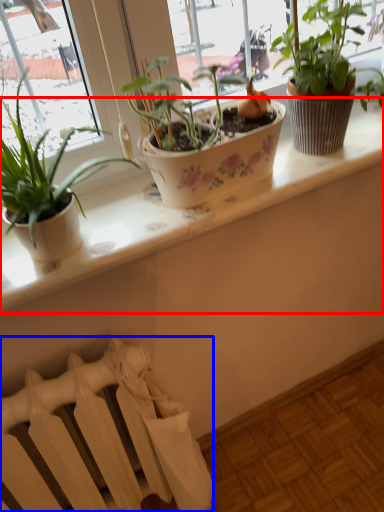
Question: Which point is closer to the camera, window sill (highlighted by a red box) or radiator (highlighted by a blue box)?

Choices:
 (A) window sill
 (B) radiator

Answer: (A)